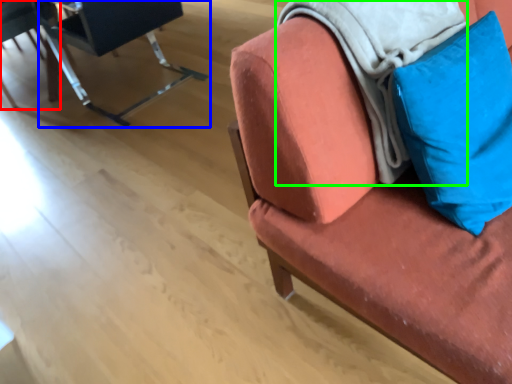
Question: Which object is positioned farthest from chair (highlighted by a red box)? Select from chair (highlighted by a blue box) and blanket (highlighted by a green box).

Choices:
 (A) chair
 (B) blanket

Answer: (B)